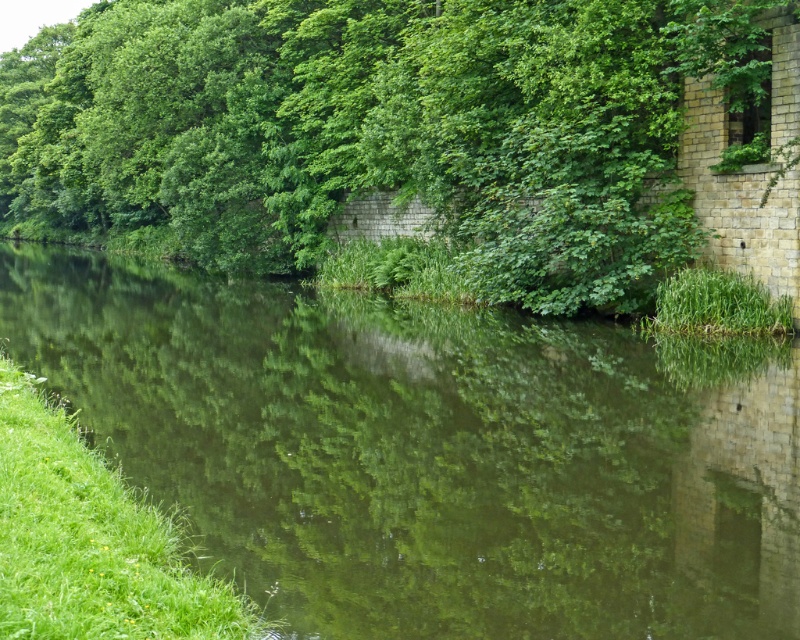
Can you confirm if green reflective water at center is positioned to the left of green leafy tree at upper left?

Incorrect, green reflective water at center is not on the left side of green leafy tree at upper left.

Is point (242, 397) positioned after point (46, 131)?

No, (242, 397) is closer to viewer.

Where is `green reflective water at center`? Image resolution: width=800 pixels, height=640 pixels. green reflective water at center is located at coordinates (432, 451).